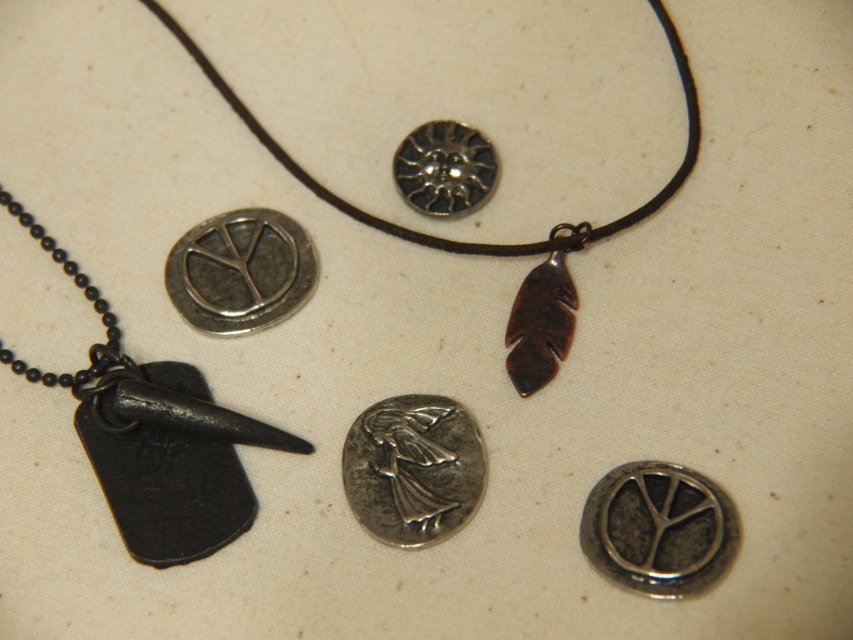
From the picture: Is silver metallic coin at center positioned before silver metallic peace sign at center-left?

Yes, silver metallic coin at center is in front of silver metallic peace sign at center-left.

This screenshot has height=640, width=853. I want to click on silver metallic coin at center, so click(x=413, y=468).

Locate an element on the screen. silver metallic coin at center is located at coordinates (413, 468).

Which is more to the left, silver metallic peace sign at upper center or silver metallic peace sign at center-left?

silver metallic peace sign at center-left

Which is behind, point (641, 488) or point (263, 225)?

Positioned behind is point (263, 225).

Locate an element on the screen. This screenshot has height=640, width=853. silver metallic peace sign at upper center is located at coordinates (659, 529).

Which of these two, silver metallic peace sign at upper center or silver metallic sun at upper center, stands shorter?

silver metallic sun at upper center is shorter.

Is silver metallic peace sign at upper center wider than silver metallic sun at upper center?

Correct, the width of silver metallic peace sign at upper center exceeds that of silver metallic sun at upper center.

Locate an element on the screen. The width and height of the screenshot is (853, 640). silver metallic peace sign at upper center is located at coordinates (659, 529).